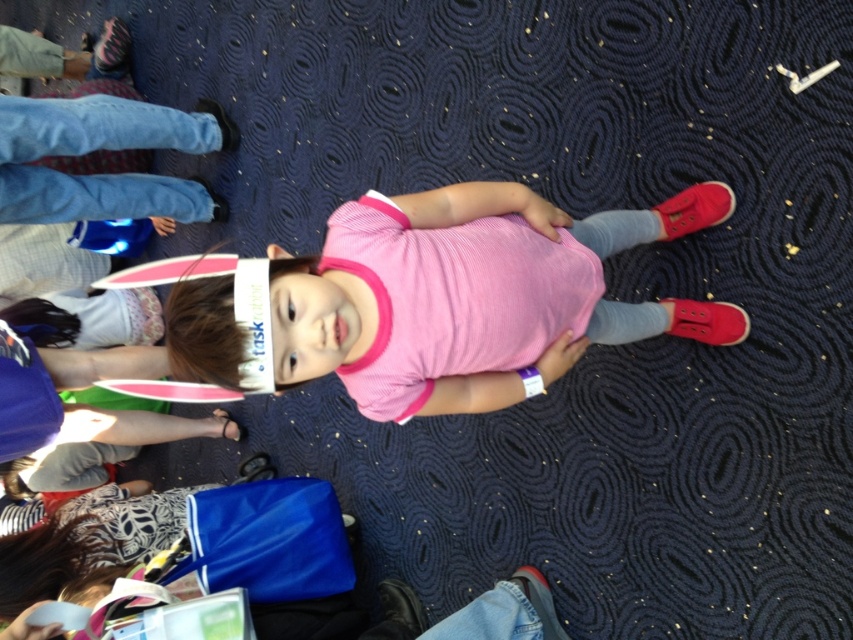
Looking at this image, you are a photographer trying to capture the child in the center of the image. The pink ribbed shirt at center is marked by point (473, 298). Where should you position your camera to ensure the child is centered in the photo?

To center the child in the photo, position the camera so that the point (473, 298) is at the center of the frame.

The child is wearing two pink items of clothing. Which one is on top, the pink ribbed shirt at center or the pink ribbed fabric dress at center?

The pink ribbed shirt at center is positioned over the pink ribbed fabric dress at center, so the shirt is on top.

In the scene shown: Based on the scene description, where is the pink ribbed shirt at center located in the image?

The pink ribbed shirt at center is located at point (473, 298) in the image.